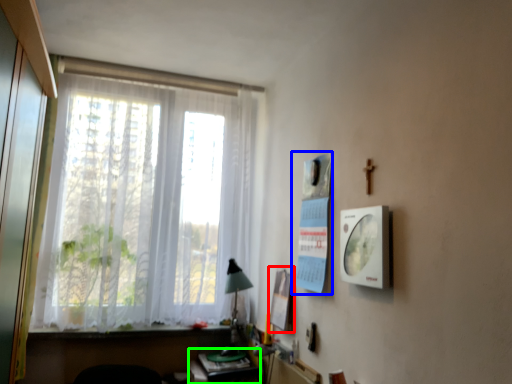
Question: Which is farther away from poster page (highlighted by a red box)? poster page (highlighted by a blue box) or table (highlighted by a green box)?

Choices:
 (A) poster page
 (B) table

Answer: (B)